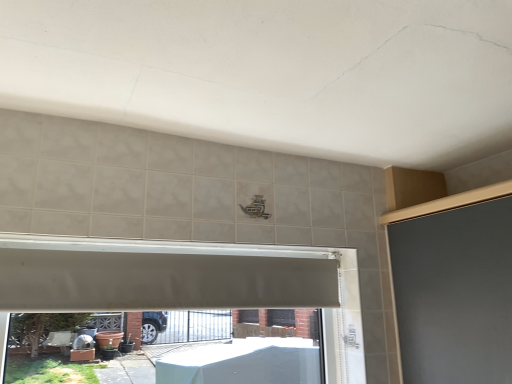
Question: Is point (173, 306) closer or farther from the camera than point (296, 269)?

Choices:
 (A) farther
 (B) closer

Answer: (B)

Question: Do you think white plastic window frame at center is within white matte exhaust hood at center, or outside of it?

Choices:
 (A) outside
 (B) inside

Answer: (A)

Question: Is white plastic window frame at center taller or shorter than white matte exhaust hood at center?

Choices:
 (A) short
 (B) tall

Answer: (B)

Question: Visually, is white matte exhaust hood at center positioned to the left or to the right of white plastic window frame at center?

Choices:
 (A) right
 (B) left

Answer: (A)

Question: From a real-world perspective, is white matte exhaust hood at center above or below white plastic window frame at center?

Choices:
 (A) below
 (B) above

Answer: (B)

Question: Do you think white matte exhaust hood at center is within white plastic window frame at center, or outside of it?

Choices:
 (A) outside
 (B) inside

Answer: (A)

Question: Considering their positions, is white matte exhaust hood at center located in front of or behind white plastic window frame at center?

Choices:
 (A) front
 (B) behind

Answer: (B)